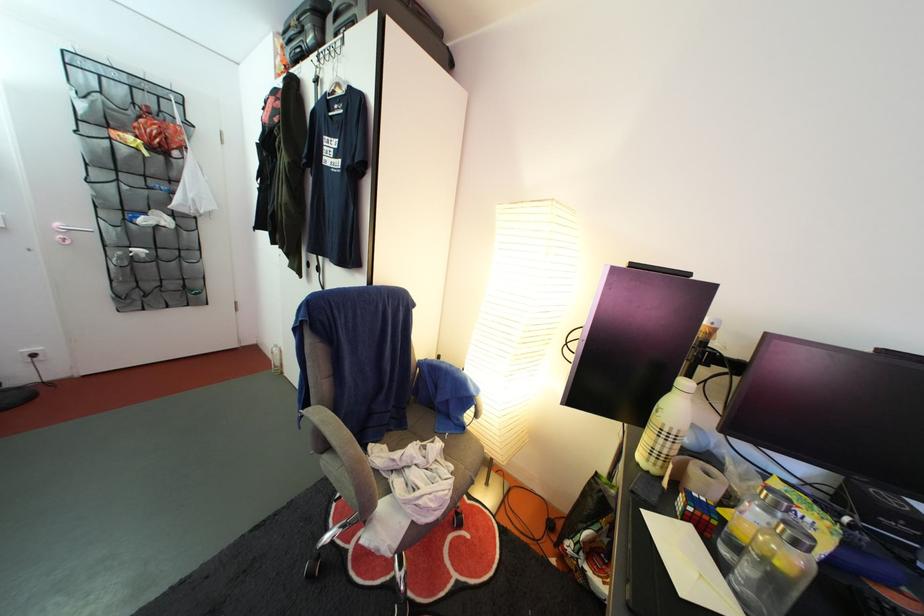
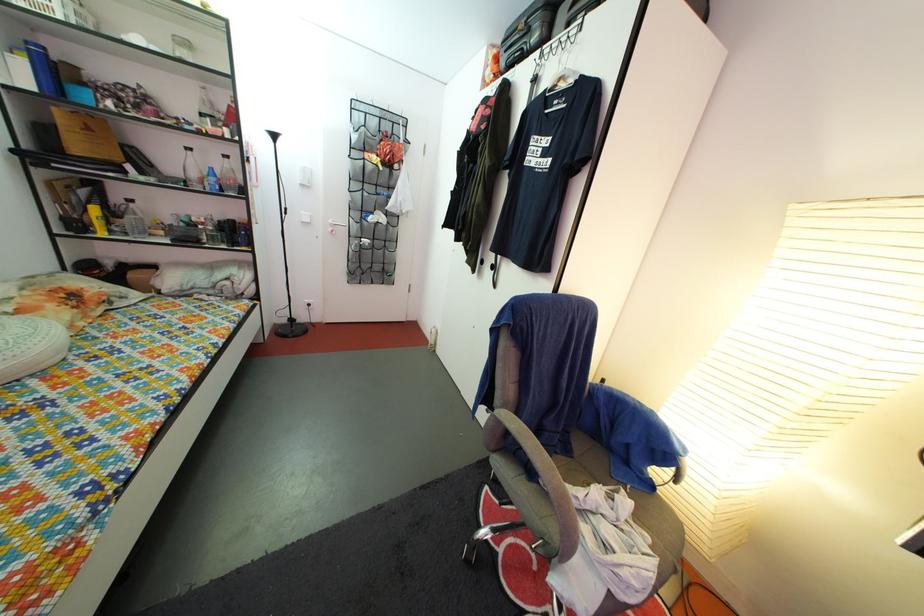
Question: The camera is either moving clockwise (left) or counter-clockwise (right) around the object. The first image is from the beginning of the video and the second image is from the end. Is the camera moving left or right when shooting the video?

Choices:
 (A) Left
 (B) Right

Answer: (B)